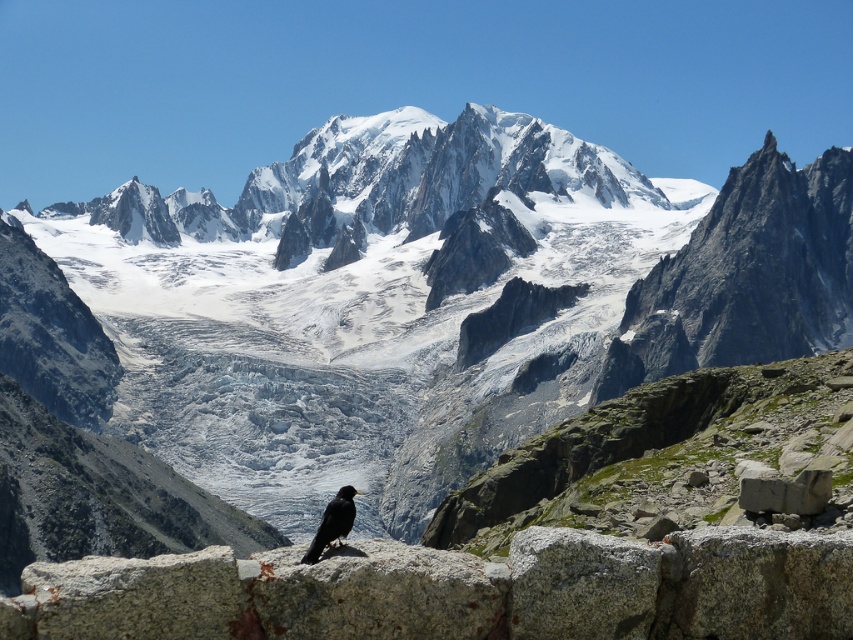
Is gray stone at lower right thinner than black matte bird at lower center?

Correct, gray stone at lower right's width is less than black matte bird at lower center's.

At what (x,y) coordinates should I click in order to perform the action: click on gray stone at lower right. Please return your answer as a coordinate pair (x, y). Looking at the image, I should click on tap(785, 492).

Between point (746, 483) and point (316, 545), which one is positioned in front?

Point (316, 545)

The width and height of the screenshot is (853, 640). I want to click on gray stone at lower right, so click(785, 492).